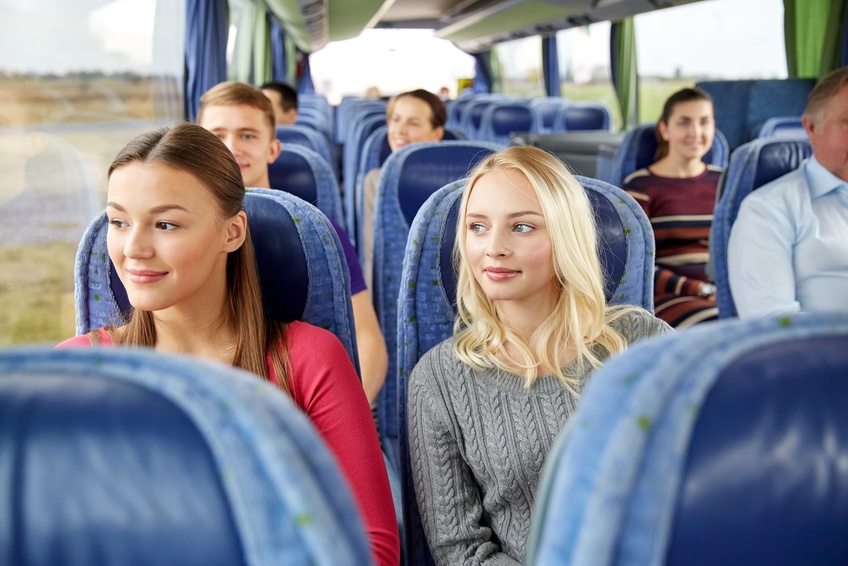
Where is `curtains`? The width and height of the screenshot is (848, 566). curtains is located at coordinates (216, 34), (268, 62), (303, 80), (486, 84), (550, 82), (628, 77), (806, 52), (291, 57).